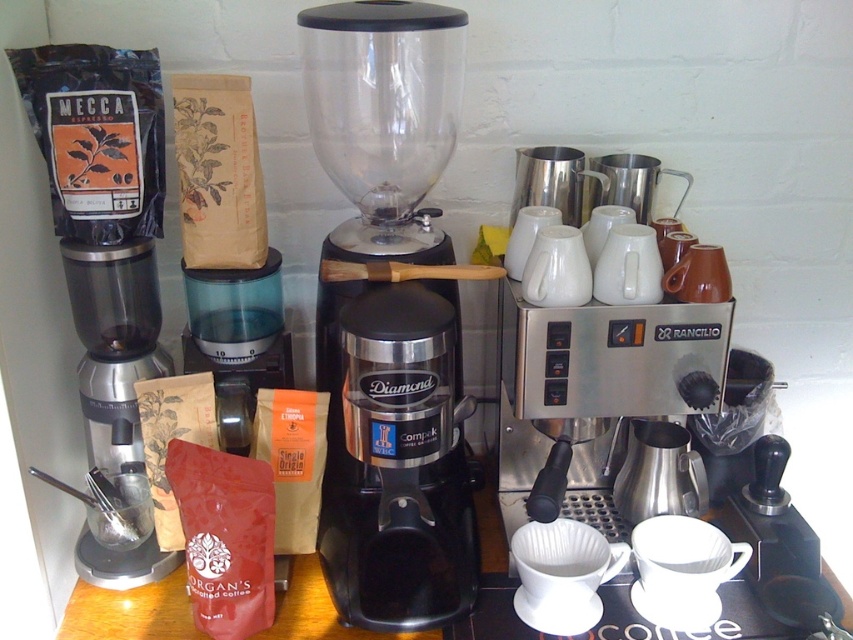
Where is the black plastic blender at center located in the image?

The black plastic blender at center is located at point (390, 314) in the image.

Consider the image. You are a barista setting up the coffee station. You need to place a 10cm tall decorative mug between the stainless steel espresso machine at center right and the matte black grinder at left. Considering their heights, will the mug be visible above the espresso machine?

The stainless steel espresso machine at center right is shorter than the matte black grinder at left. Since the mug is 10cm tall, placing it between them would mean it could be visible above the espresso machine, which is the shorter one.

You are a barista setting up a new coffee station. You need to place a new coffee cup exactly at the point marked by coordinates point (390, 314). What object will the cup be placed on top of?

The point (390, 314) corresponds to the black plastic blender at center, so the cup will be placed on top of the black plastic blender at center.